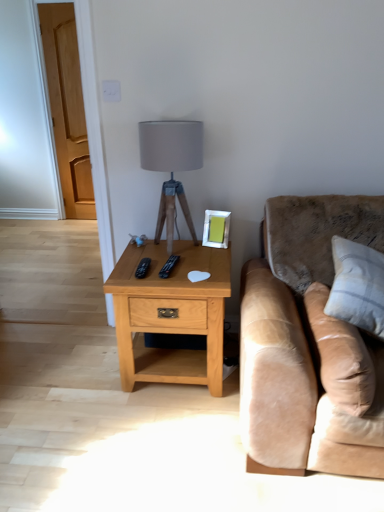
Question: Is matte gray fabric lampshade at center facing towards light oak wood nightstand at center?

Choices:
 (A) yes
 (B) no

Answer: (B)

Question: Considering the relative positions of matte gray fabric lampshade at center and light oak wood nightstand at center in the image provided, is matte gray fabric lampshade at center behind light oak wood nightstand at center?

Choices:
 (A) yes
 (B) no

Answer: (A)

Question: Can you confirm if matte gray fabric lampshade at center is shorter than light oak wood nightstand at center?

Choices:
 (A) no
 (B) yes

Answer: (A)

Question: From a real-world perspective, is matte gray fabric lampshade at center over light oak wood nightstand at center?

Choices:
 (A) yes
 (B) no

Answer: (A)

Question: Considering the relative sizes of matte gray fabric lampshade at center and light oak wood nightstand at center in the image provided, is matte gray fabric lampshade at center bigger than light oak wood nightstand at center?

Choices:
 (A) yes
 (B) no

Answer: (B)

Question: Looking at their shapes, would you say silver metallic picture frame at upper right is wider or thinner than beige leather pillow at right, arranged as the 2th pillow when viewed from the right?

Choices:
 (A) wide
 (B) thin

Answer: (B)

Question: Does point (x=225, y=226) appear closer or farther from the camera than point (x=360, y=415)?

Choices:
 (A) closer
 (B) farther

Answer: (B)

Question: Is silver metallic picture frame at upper right bigger or smaller than beige leather pillow at right, which is the first pillow in left-to-right order?

Choices:
 (A) big
 (B) small

Answer: (B)

Question: Considering the relative positions of silver metallic picture frame at upper right and beige leather pillow at right, arranged as the 2th pillow when viewed from the right, in the image provided, is silver metallic picture frame at upper right to the left or to the right of beige leather pillow at right, arranged as the 2th pillow when viewed from the right,?

Choices:
 (A) left
 (B) right

Answer: (A)

Question: From the image's perspective, is suede beige couch at right located above or below light oak wood nightstand at center?

Choices:
 (A) above
 (B) below

Answer: (A)

Question: Considering their positions, is suede beige couch at right located in front of or behind light oak wood nightstand at center?

Choices:
 (A) behind
 (B) front

Answer: (B)

Question: Is suede beige couch at right to the left or to the right of light oak wood nightstand at center in the image?

Choices:
 (A) left
 (B) right

Answer: (B)

Question: Considering the positions of suede beige couch at right and light oak wood nightstand at center in the image, is suede beige couch at right taller or shorter than light oak wood nightstand at center?

Choices:
 (A) short
 (B) tall

Answer: (B)

Question: Does point (283, 390) appear closer or farther from the camera than point (322, 318)?

Choices:
 (A) closer
 (B) farther

Answer: (A)

Question: In the image, is suede beige couch at right positioned in front of or behind beige leather pillow at right, arranged as the 2th pillow when viewed from the right?

Choices:
 (A) front
 (B) behind

Answer: (A)